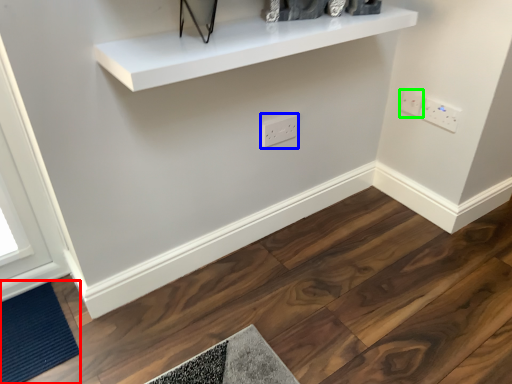
Question: Based on their relative distances, which object is nearer to doormat (highlighted by a red box)? Choose from electric outlet (highlighted by a blue box) and electric outlet (highlighted by a green box).

Choices:
 (A) electric outlet
 (B) electric outlet

Answer: (A)